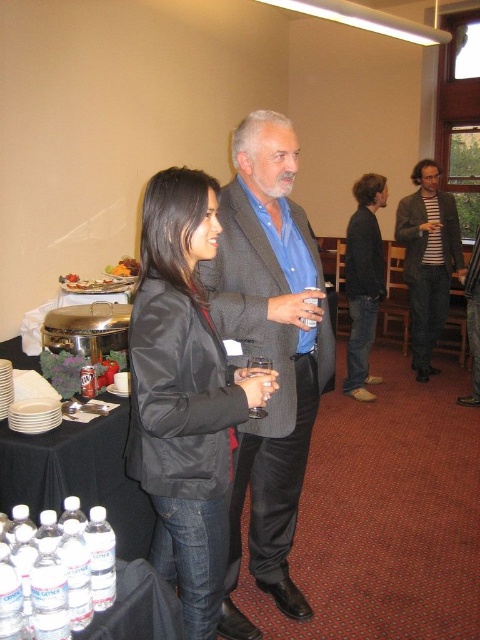
Between black wool suit at center and clear plastic water bottles at lower left, which one has less height?

clear plastic water bottles at lower left is shorter.

Between black wool suit at center and clear plastic water bottles at lower left, which one is positioned higher?

Positioned higher is black wool suit at center.

This screenshot has width=480, height=640. Describe the element at coordinates (361, 291) in the screenshot. I see `black wool suit at center` at that location.

Where is `black wool suit at center`? black wool suit at center is located at coordinates (361, 291).

In the scene shown: Can you confirm if gray wool suit at center is positioned to the left of clear plastic bottles at lower left?

No, gray wool suit at center is not to the left of clear plastic bottles at lower left.

Does gray wool suit at center have a smaller size compared to clear plastic bottles at lower left?

No, gray wool suit at center is not smaller than clear plastic bottles at lower left.

Is point (247, 216) positioned in front of point (124, 404)?

Yes, point (247, 216) is in front of point (124, 404).

Locate an element on the screen. This screenshot has width=480, height=640. gray wool suit at center is located at coordinates (269, 352).

Is point (308, 342) behind point (108, 577)?

Yes, point (308, 342) is behind point (108, 577).

Does gray wool suit at center have a smaller size compared to clear plastic water bottles at lower left?

Incorrect, gray wool suit at center is not smaller in size than clear plastic water bottles at lower left.

I want to click on gray wool suit at center, so click(269, 352).